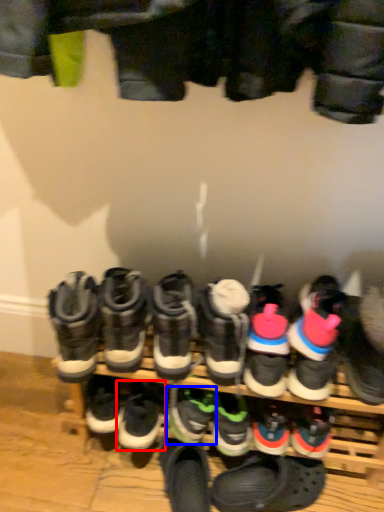
Question: Which of the following is the farthest to the observer, footwear (highlighted by a red box) or footwear (highlighted by a blue box)?

Choices:
 (A) footwear
 (B) footwear

Answer: (A)